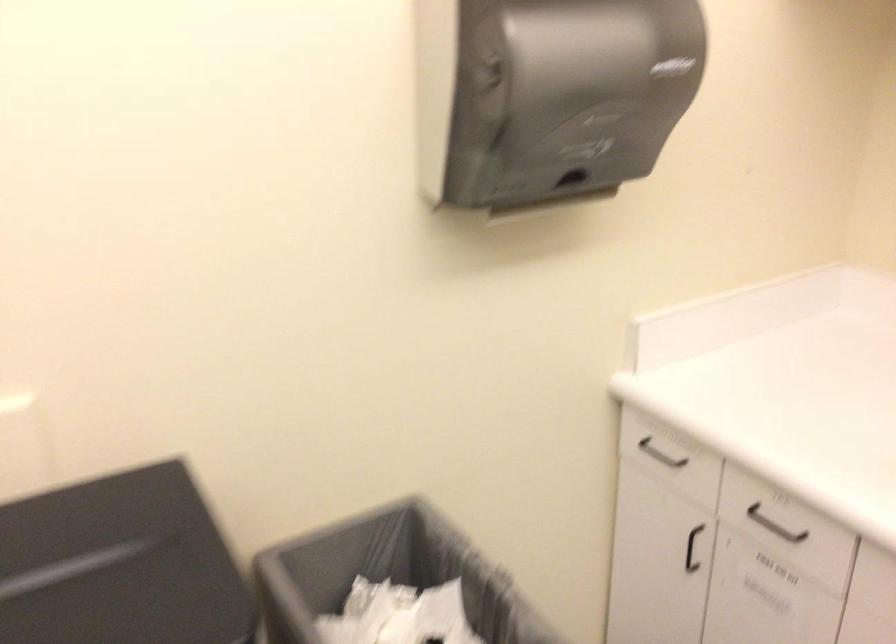
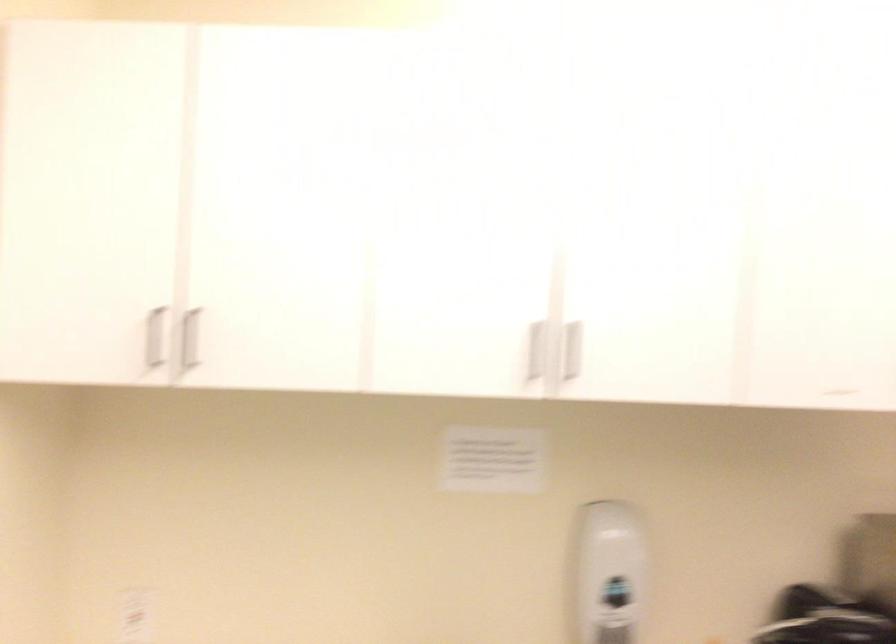
Question: The images are taken continuously from a first-person perspective. In which direction is your viewpoint rotating?

Choices:
 (A) Left
 (B) Right
 (C) Up
 (D) Down

Answer: (B)